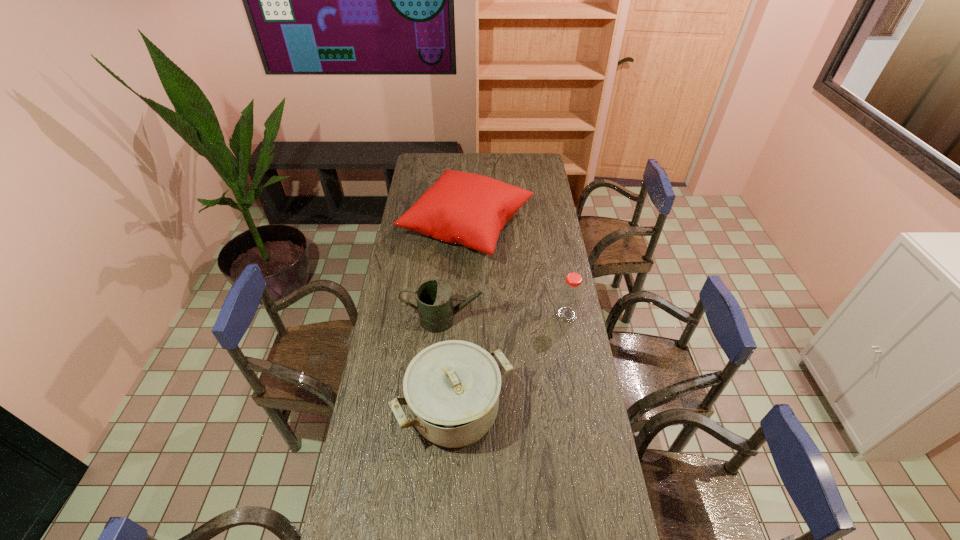
Locate an element on the screen. Image resolution: width=960 pixels, height=540 pixels. free space between the farthest object and the nearest object is located at coordinates (461, 319).

Locate an element on the screen. object identified as the third closest to the watering can is located at coordinates (570, 296).

Identify which object is located as the nearest to the rightmost object. Please provide its 2D coordinates. Your answer should be formatted as a tuple, i.e. [(x, y)], where the tuple contains the x and y coordinates of a point satisfying the conditions above.

[(469, 209)]

Where is `vacant point that satisfies the following two spatial constraints: 1. with the spout on the saucepan; 2. on the right side of the watering can`? Image resolution: width=960 pixels, height=540 pixels. vacant point that satisfies the following two spatial constraints: 1. with the spout on the saucepan; 2. on the right side of the watering can is located at coordinates (441, 410).

Where is `free location that satisfies the following two spatial constraints: 1. with the spout on the watering can; 2. on the right side of the saucepan`? free location that satisfies the following two spatial constraints: 1. with the spout on the watering can; 2. on the right side of the saucepan is located at coordinates (441, 410).

This screenshot has width=960, height=540. Identify the location of free region that satisfies the following two spatial constraints: 1. with the spout on the watering can; 2. on the back side of the nearest object. (441, 410).

Find the location of `vacant area in the image that satisfies the following two spatial constraints: 1. with the spout on the watering can; 2. on the back side of the saucepan`. vacant area in the image that satisfies the following two spatial constraints: 1. with the spout on the watering can; 2. on the back side of the saucepan is located at coordinates (441, 410).

The height and width of the screenshot is (540, 960). I want to click on free space that satisfies the following two spatial constraints: 1. on the front side of the bottle; 2. with the spout on the watering can, so click(x=567, y=319).